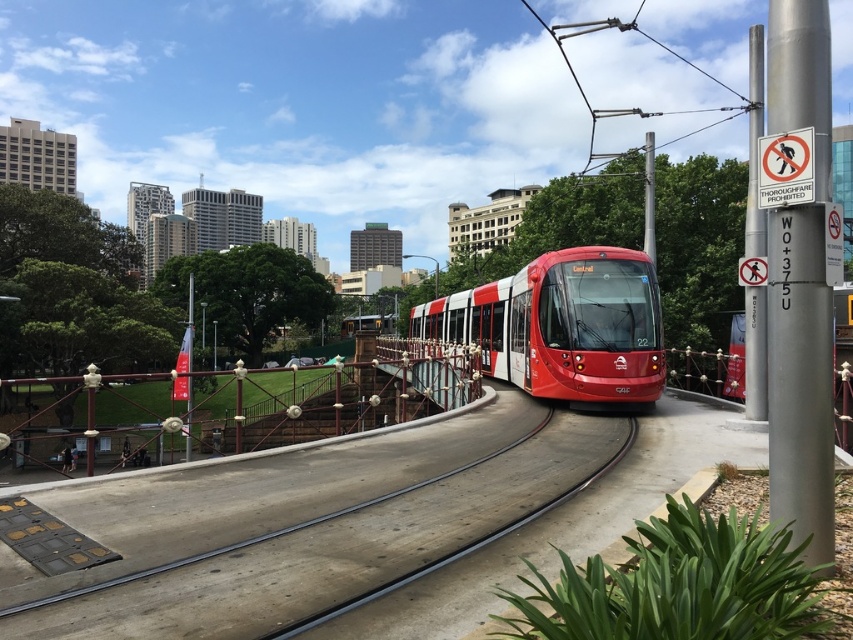
From the picture: Does shiny red tram at center appear on the left side of smooth concrete train track at center?

No, shiny red tram at center is not to the left of smooth concrete train track at center.

Between shiny red tram at center and smooth concrete train track at center, which one is positioned lower?

Positioned lower is smooth concrete train track at center.

What do you see at coordinates (561, 324) in the screenshot? Image resolution: width=853 pixels, height=640 pixels. I see `shiny red tram at center` at bounding box center [561, 324].

You are a GUI agent. You are given a task and a screenshot of the screen. Output one action in this format:
    pyautogui.click(x=<x>, y=<y>)
    Task: Click on the shiny red tram at center
    This screenshot has width=853, height=640.
    Given the screenshot: What is the action you would take?
    pyautogui.click(x=561, y=324)